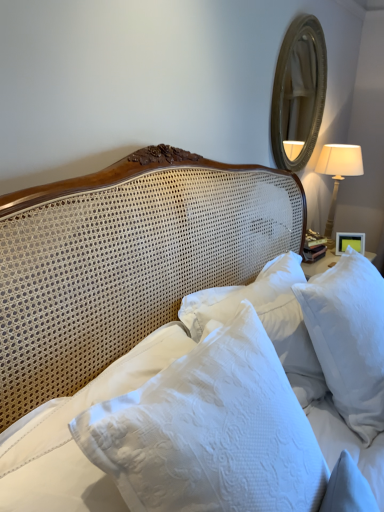
Question: Which direction should I rotate to look at white textured pillow at center, acting as the 2th pillow starting from the right, — up or down?

Choices:
 (A) up
 (B) down

Answer: (B)

Question: From the image's perspective, does gold-toned wooden mirror at upper right appear lower than white textured pillow at center, which is counted as the 1th pillow, starting from the left?

Choices:
 (A) yes
 (B) no

Answer: (B)

Question: Is there a large distance between gold-toned wooden mirror at upper right and white textured pillow at center, which is counted as the 1th pillow, starting from the left?

Choices:
 (A) no
 (B) yes

Answer: (B)

Question: Can you confirm if gold-toned wooden mirror at upper right is thinner than white textured pillow at center, acting as the 2th pillow starting from the right?

Choices:
 (A) yes
 (B) no

Answer: (A)

Question: From the image's perspective, is gold-toned wooden mirror at upper right on top of white textured pillow at center, acting as the 2th pillow starting from the right?

Choices:
 (A) no
 (B) yes

Answer: (B)

Question: Can you confirm if gold-toned wooden mirror at upper right is shorter than white textured pillow at center, acting as the 2th pillow starting from the right?

Choices:
 (A) yes
 (B) no

Answer: (B)

Question: Is the depth of gold-toned wooden mirror at upper right greater than that of white textured pillow at center, acting as the 2th pillow starting from the right?

Choices:
 (A) yes
 (B) no

Answer: (A)

Question: Does white fabric lampshade at right lie behind white textured pillows at center?

Choices:
 (A) no
 (B) yes

Answer: (B)

Question: Is white fabric lampshade at right thinner than white textured pillows at center?

Choices:
 (A) no
 (B) yes

Answer: (A)

Question: Can we say white fabric lampshade at right lies outside white textured pillows at center?

Choices:
 (A) no
 (B) yes

Answer: (B)

Question: From the image's perspective, is white fabric lampshade at right on white textured pillows at center?

Choices:
 (A) no
 (B) yes

Answer: (B)

Question: Is white fabric lampshade at right oriented towards white textured pillows at center?

Choices:
 (A) no
 (B) yes

Answer: (A)

Question: Is white fabric lampshade at right oriented away from white textured pillows at center?

Choices:
 (A) yes
 (B) no

Answer: (B)

Question: Is white textured pillows at center located within gold-toned wooden mirror at upper right?

Choices:
 (A) no
 (B) yes

Answer: (A)